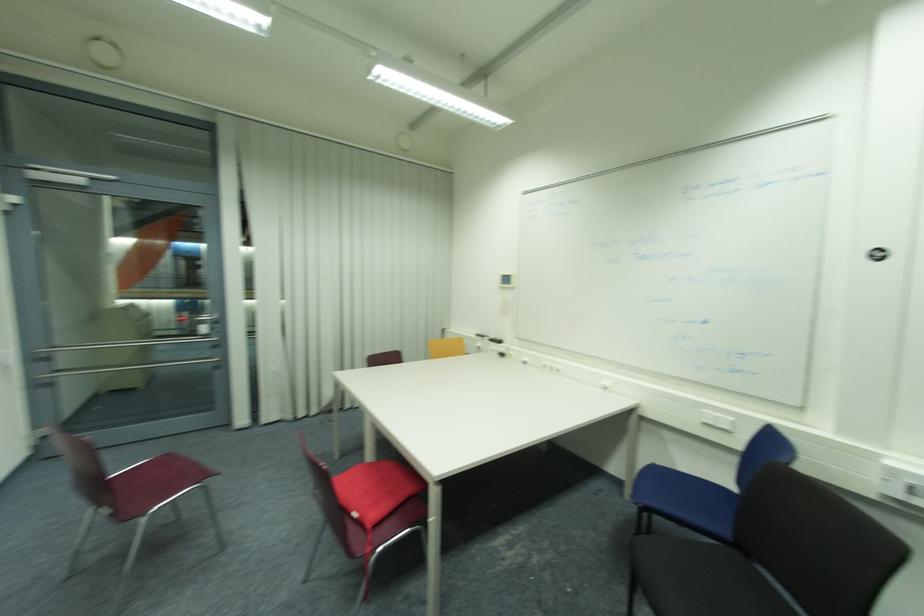
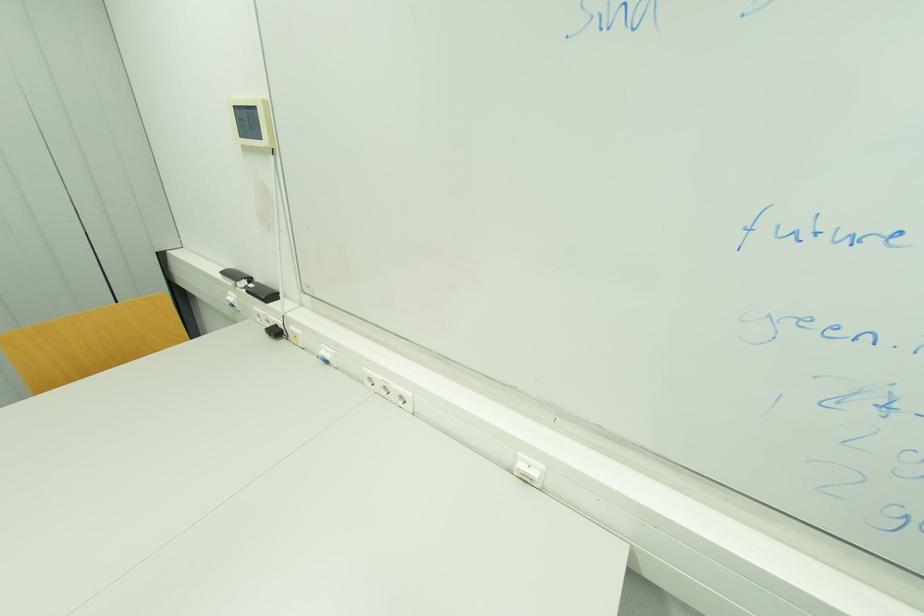
In the second image, find the point that corresponds to point (507, 276) in the first image.

(237, 108)